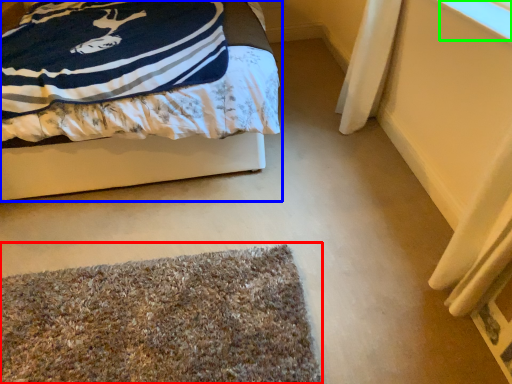
Question: Estimate the real-world distances between objects in this image. Which object is closer to mat (highlighted by a red box), bed (highlighted by a blue box) or window screen (highlighted by a green box)?

Choices:
 (A) bed
 (B) window screen

Answer: (A)